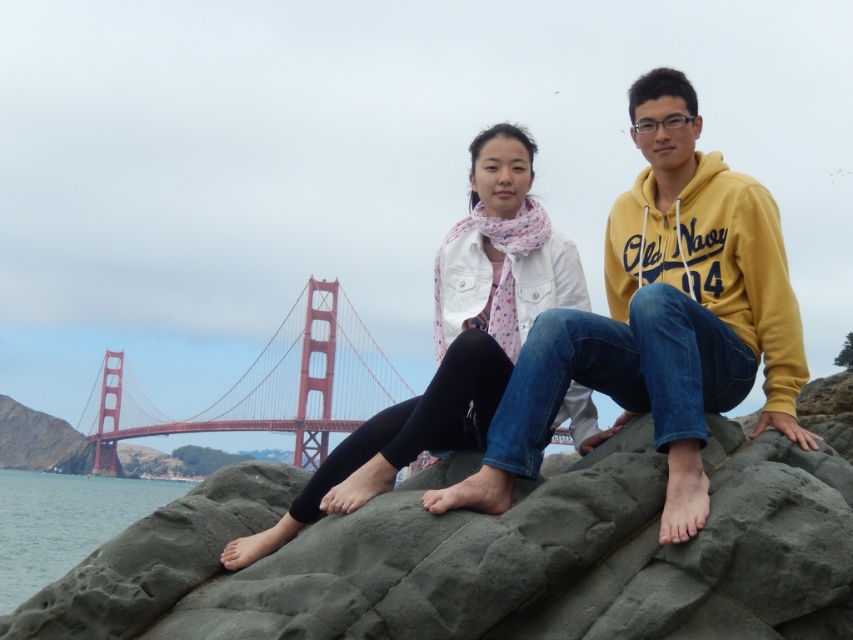
Is gray rough rock at center above matte yellow hoodie at center?

Incorrect, gray rough rock at center is not positioned above matte yellow hoodie at center.

Between point (395, 566) and point (505, 445), which one is positioned in front?

Point (395, 566) is in front.

Who is more forward, (624, 579) or (757, 218)?

Point (624, 579) is in front.

Where is `gray rough rock at center`? The width and height of the screenshot is (853, 640). gray rough rock at center is located at coordinates (485, 557).

Which is more to the left, matte yellow hoodie at center or clear water at lower left?

Positioned to the left is clear water at lower left.

Between matte yellow hoodie at center and clear water at lower left, which one has less height?

With less height is matte yellow hoodie at center.

Is point (662, 342) positioned after point (1, 611)?

No, it is not.

Find the location of a particular element. The image size is (853, 640). matte yellow hoodie at center is located at coordinates (637, 320).

Which is above, matte yellow hoodie at center or red painted steel bridge at center?

matte yellow hoodie at center is above.

Consider the image. Who is more forward, (543, 369) or (347, 356)?

Point (543, 369) is more forward.

Identify the location of matte yellow hoodie at center. (637, 320).